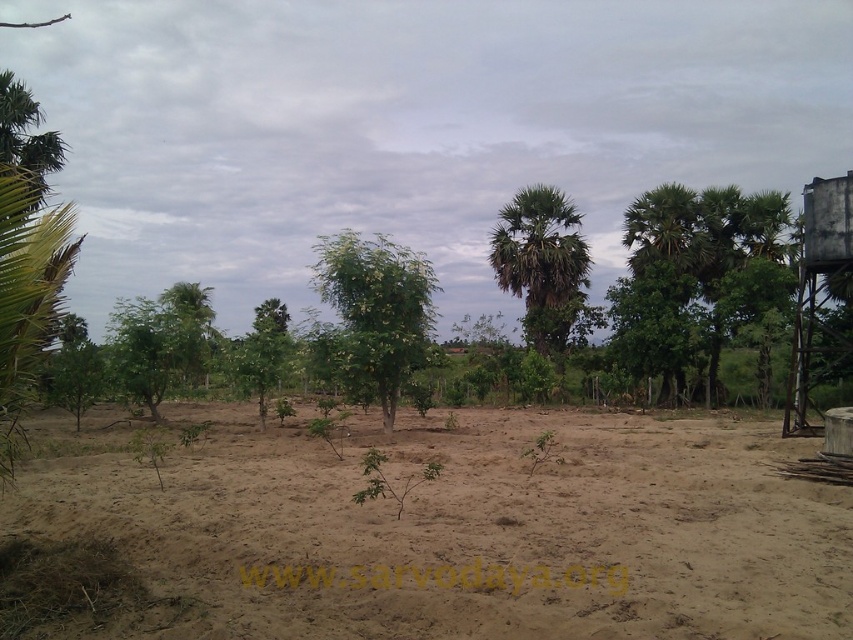
Question: Where is green leafy tree at center located in relation to green leafy palm tree at center in the image?

Choices:
 (A) above
 (B) below

Answer: (B)

Question: Is the position of green leafy tree at center less distant than that of green leafy palm tree at center?

Choices:
 (A) no
 (B) yes

Answer: (B)

Question: Which of these objects is positioned closest to the brown sandy soil at center?

Choices:
 (A) green leafy tree at center
 (B) green leafy palm tree at center

Answer: (A)

Question: Does brown sandy soil at center come in front of green leafy palm tree at center?

Choices:
 (A) yes
 (B) no

Answer: (A)

Question: Among these objects, which one is farthest from the camera?

Choices:
 (A) brown sandy soil at center
 (B) green leafy tree at center

Answer: (B)

Question: Estimate the real-world distances between objects in this image. Which object is farther from the green leafy palm tree at center?

Choices:
 (A) brown sandy soil at center
 (B) green leafy tree at center

Answer: (A)